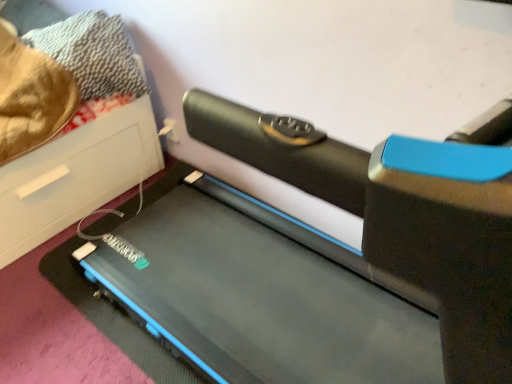
Question: From a real-world perspective, relative to black rubber treadmill at center, is black rubber treadmill at lower left vertically above or below?

Choices:
 (A) above
 (B) below

Answer: (B)

Question: Is black rubber treadmill at lower left in front of or behind black rubber treadmill at center in the image?

Choices:
 (A) behind
 (B) front

Answer: (A)

Question: In terms of height, does black rubber treadmill at lower left look taller or shorter compared to black rubber treadmill at center?

Choices:
 (A) tall
 (B) short

Answer: (B)

Question: In the image, is black rubber treadmill at center positioned in front of or behind black rubber treadmill at lower left?

Choices:
 (A) behind
 (B) front

Answer: (B)

Question: Is point (241, 344) closer or farther from the camera than point (54, 160)?

Choices:
 (A) farther
 (B) closer

Answer: (B)

Question: From a real-world perspective, relative to black rubber treadmill at lower left, is black rubber treadmill at center vertically above or below?

Choices:
 (A) above
 (B) below

Answer: (A)

Question: Considering the relative positions of black rubber treadmill at center and black rubber treadmill at lower left in the image provided, is black rubber treadmill at center to the left or to the right of black rubber treadmill at lower left?

Choices:
 (A) right
 (B) left

Answer: (A)